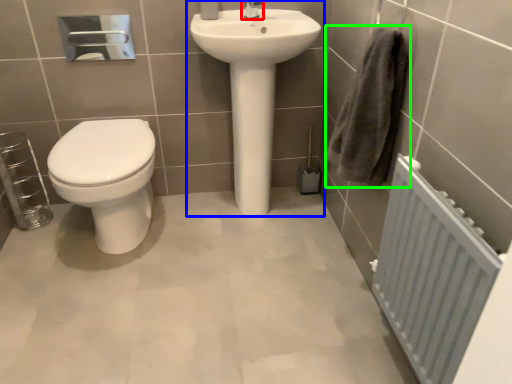
Question: Considering the real-world distances, which object is closest to tap (highlighted by a red box)? sink (highlighted by a blue box) or bath towel (highlighted by a green box).

Choices:
 (A) sink
 (B) bath towel

Answer: (A)